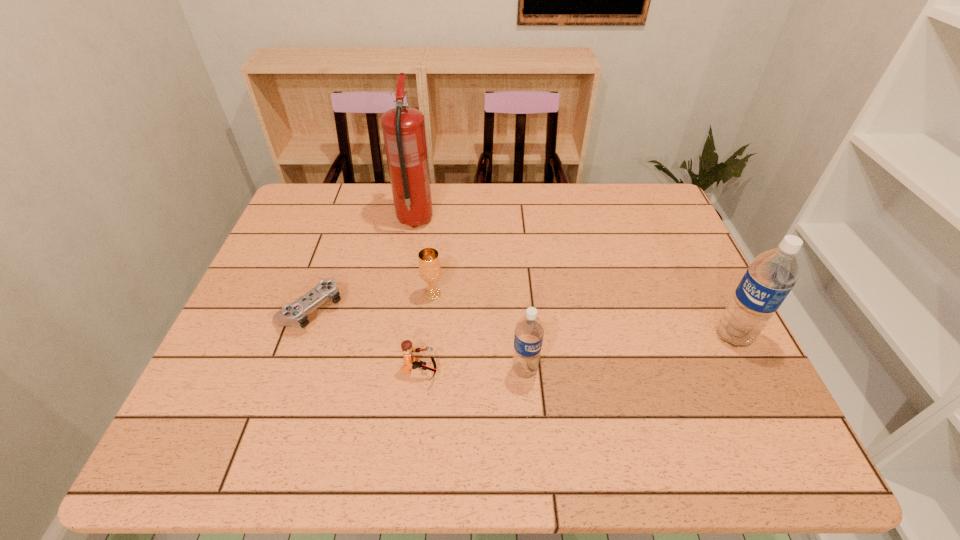
Locate an element on the screen. The image size is (960, 540). object that is at the right edge is located at coordinates (771, 276).

The height and width of the screenshot is (540, 960). I want to click on vacant space at the far edge of the desktop, so click(613, 219).

Image resolution: width=960 pixels, height=540 pixels. I want to click on free space at the near edge of the desktop, so pos(554,395).

I want to click on vacant region at the left edge of the desktop, so click(301, 267).

At what (x,y) coordinates should I click in order to perform the action: click on vacant space at the right edge. Please return your answer as a coordinate pair (x, y). The image size is (960, 540). Looking at the image, I should click on click(683, 249).

In the image, there is a desktop. At what (x,y) coordinates should I click in order to perform the action: click on vacant region at the near left corner. Please return your answer as a coordinate pair (x, y). Looking at the image, I should click on (280, 387).

Locate an element on the screen. This screenshot has height=540, width=960. vacant space at the far right corner is located at coordinates (614, 205).

I want to click on free region at the near right corner of the desktop, so click(740, 399).

Locate an element on the screen. empty space that is in between the third shortest object and the second tallest object is located at coordinates (583, 315).

At what (x,y) coordinates should I click in order to perform the action: click on vacant space that's between the Lego and the tallest object. Please return your answer as a coordinate pair (x, y). Looking at the image, I should click on (418, 296).